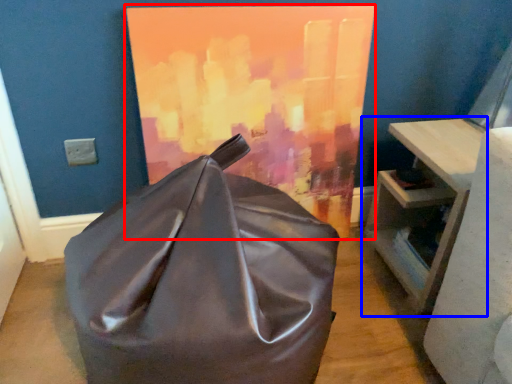
Question: Among these objects, which one is nearest to the camera, oil painting (highlighted by a red box) or table (highlighted by a blue box)?

Choices:
 (A) oil painting
 (B) table

Answer: (A)